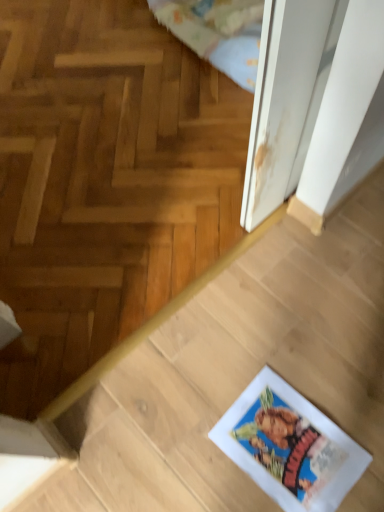
Where is `vacant area on top of white paper postcard at lower right (from a real-world perspective)`? vacant area on top of white paper postcard at lower right (from a real-world perspective) is located at coordinates (291, 446).